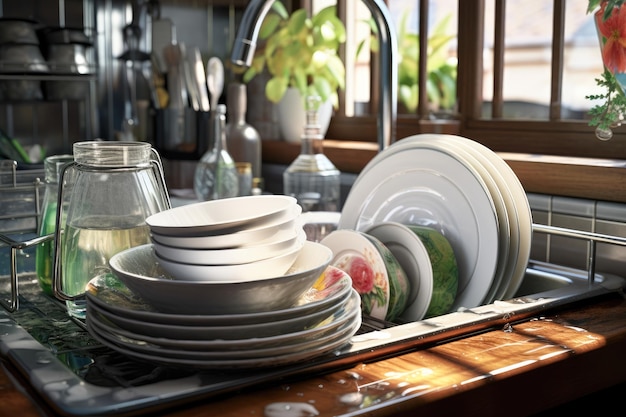
This screenshot has width=626, height=417. What are the coordinates of `bowls` in the screenshot? It's located at (398, 281), (443, 276), (302, 275), (258, 270), (245, 252), (239, 238), (221, 223).